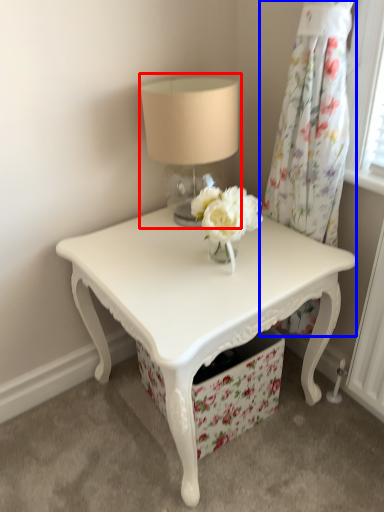
Question: Among these objects, which one is nearest to the camera, table lamp (highlighted by a red box) or curtain (highlighted by a blue box)?

Choices:
 (A) table lamp
 (B) curtain

Answer: (B)